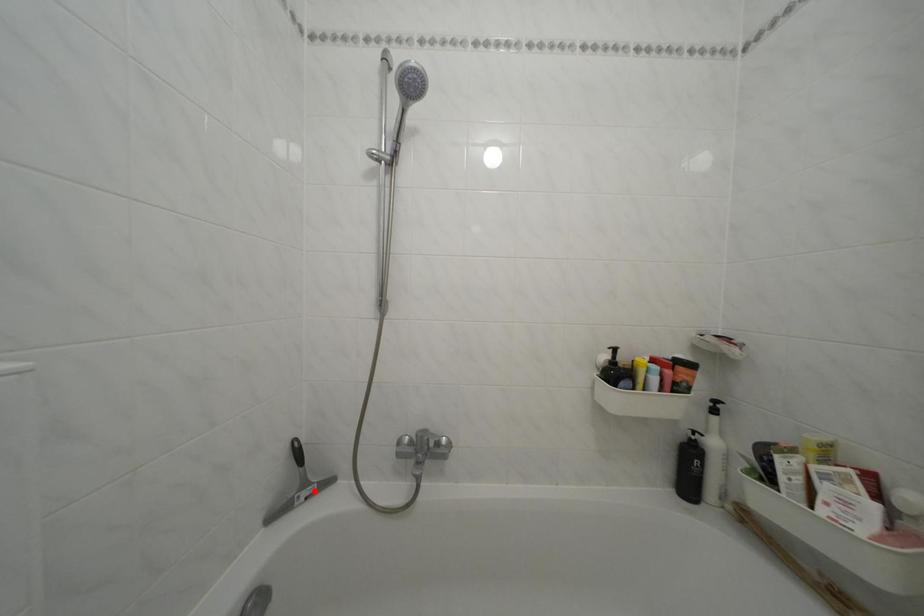
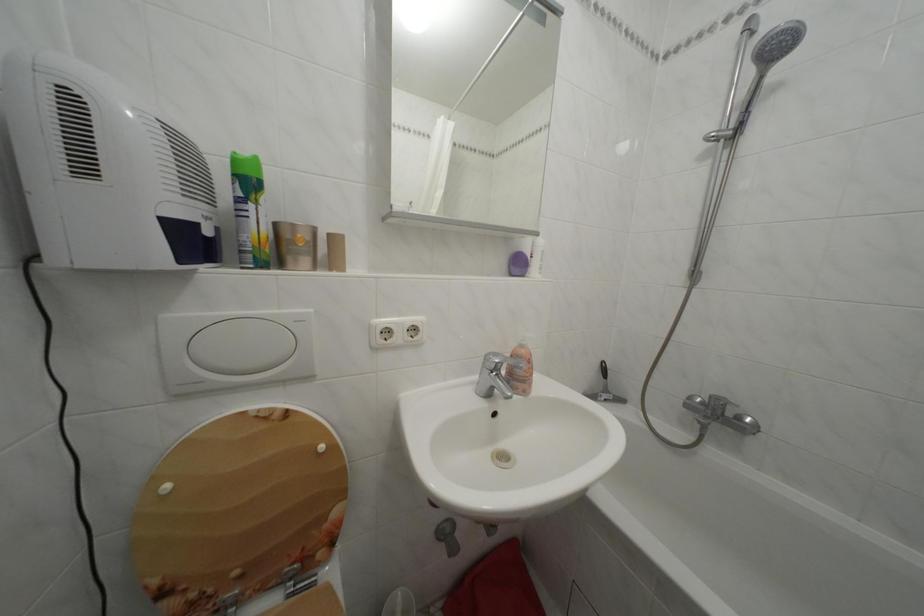
Question: A red point is marked in image1. In image2, is the corresponding 3D point closer to the camera or farther? Reply with the corresponding letter.

Choices:
 (A) The corresponding 3D point is closer.
 (B) The corresponding 3D point is farther.

Answer: (B)